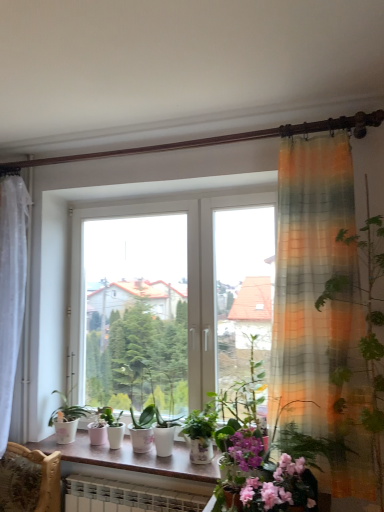
Question: Is green matte plant at center to the left or to the right of pink matte flower at lower center in the image?

Choices:
 (A) left
 (B) right

Answer: (A)

Question: Is green matte plant at center in front of or behind pink matte flower at lower center in the image?

Choices:
 (A) front
 (B) behind

Answer: (B)

Question: Which object is positioned farthest from the green matte plant at center?

Choices:
 (A) pink matte flower at lower center
 (B) white glossy window sill at center

Answer: (A)

Question: Which is nearer to the pink matte flower at lower center?

Choices:
 (A) green matte plant at center
 (B) white glossy window sill at center

Answer: (B)